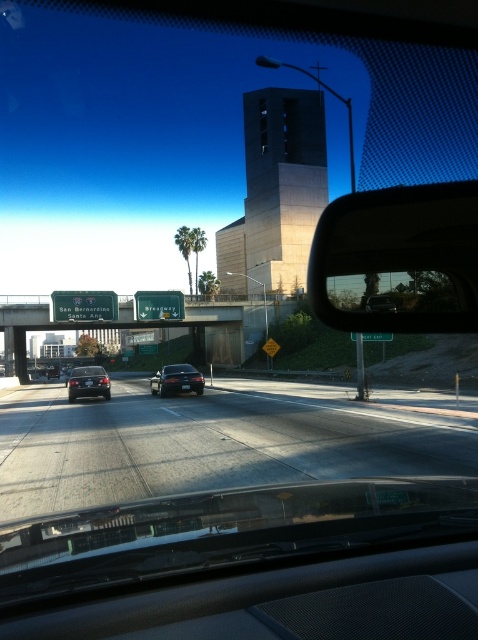
You are driving a car and see two sedans ahead on the highway. The scene shows a satin black sedan at center and a shiny black sedan at center. Which one is closer to your car?

The satin black sedan at center is closer because it is positioned in front of the shiny black sedan at center.

You are sitting in the driver seat of a car and looking out through the windshield. There is a point at coordinate (398, 259) on the windshield. Based on the scene description, can you determine what object this point is located on?

The point at coordinate (398, 259) is located on the black plastic side mirror at center right.